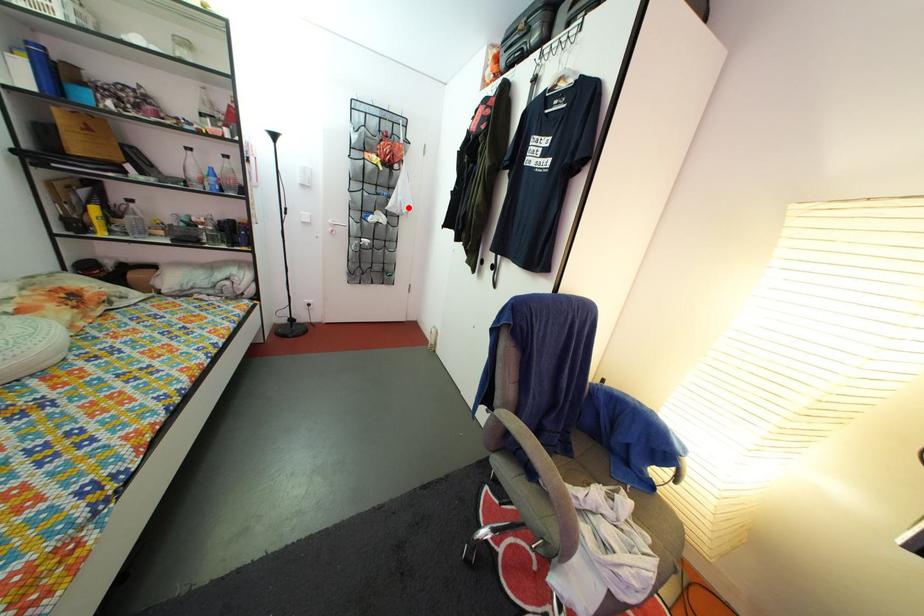
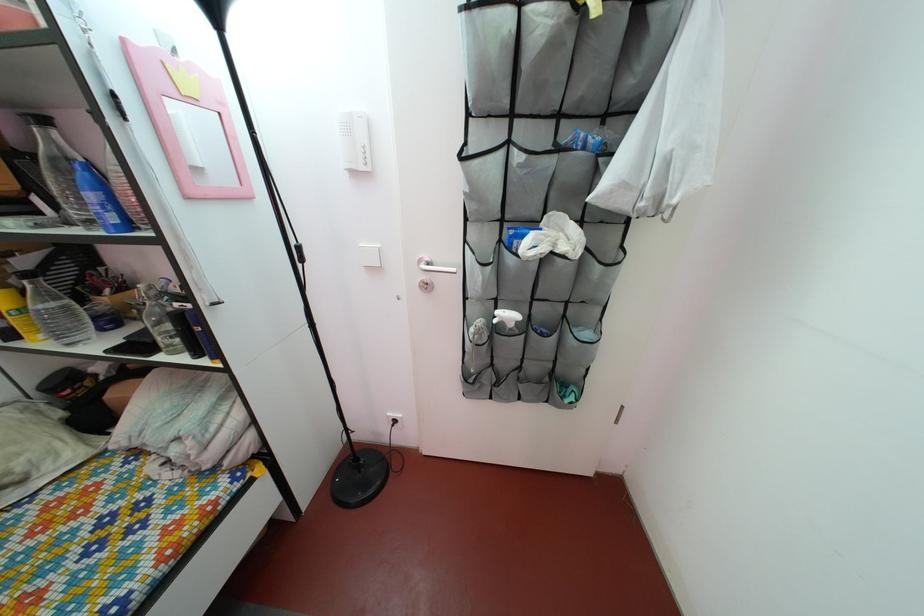
In the second image, find the point that corresponds to the highlighted location in the first image.

(675, 152)